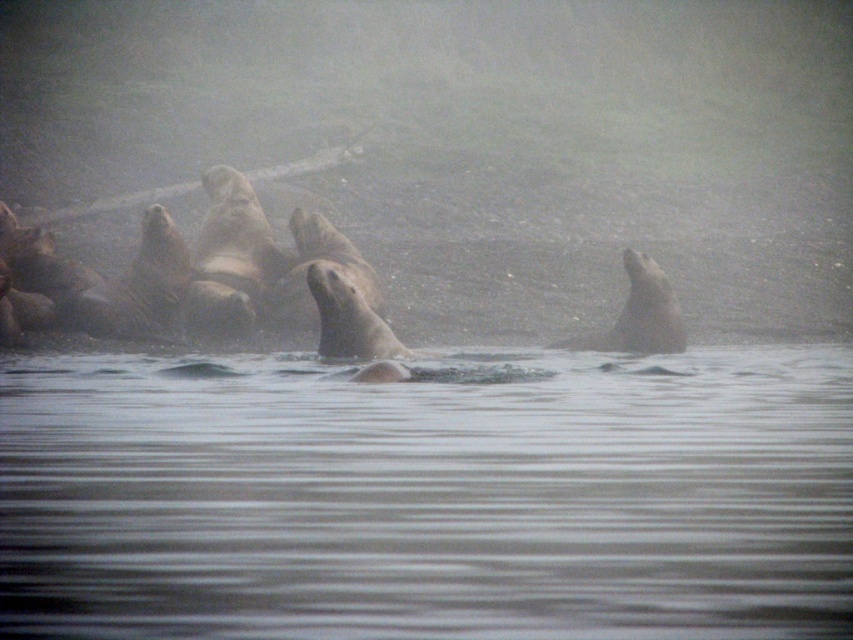
You are a wildlife photographer aiming to capture a closeup of the gray fur seal at center and the brown fur seal at center. Since the seals are in a misty environment, you need to adjust your camera focus. Which seal should you focus on first to ensure clarity?

You should focus on the gray fur seal at center first because it is closer to you than the brown fur seal at center, so capturing it clearly requires adjusting focus for the nearer subject first.

You are a wildlife photographer aiming to capture the seals in the scene. You want to take a photo that includes both the smooth gray seal at right and the brown fur seal at center. Which seal should you focus on first if you want to ensure both are in frame?

The smooth gray seal at right is bigger than the brown fur seal at center, so you should focus on the brown fur seal at center first to ensure both fit in the frame.